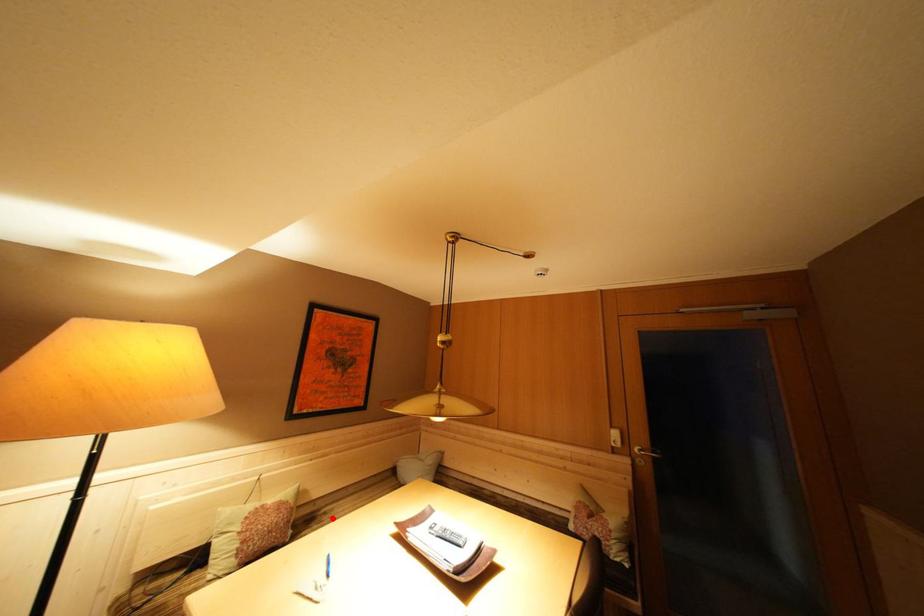
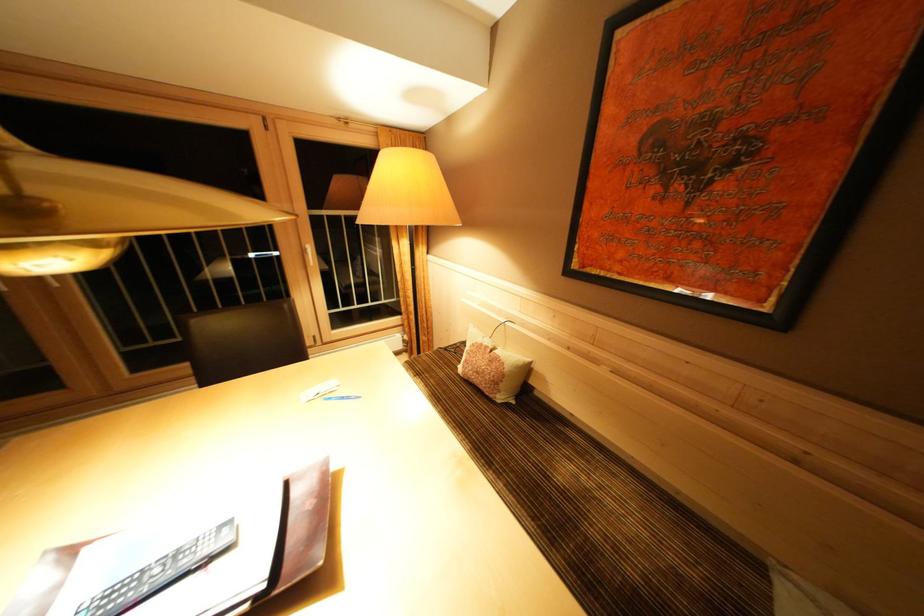
Find the pixel in the second image that matches the highlighted location in the first image.

(565, 438)